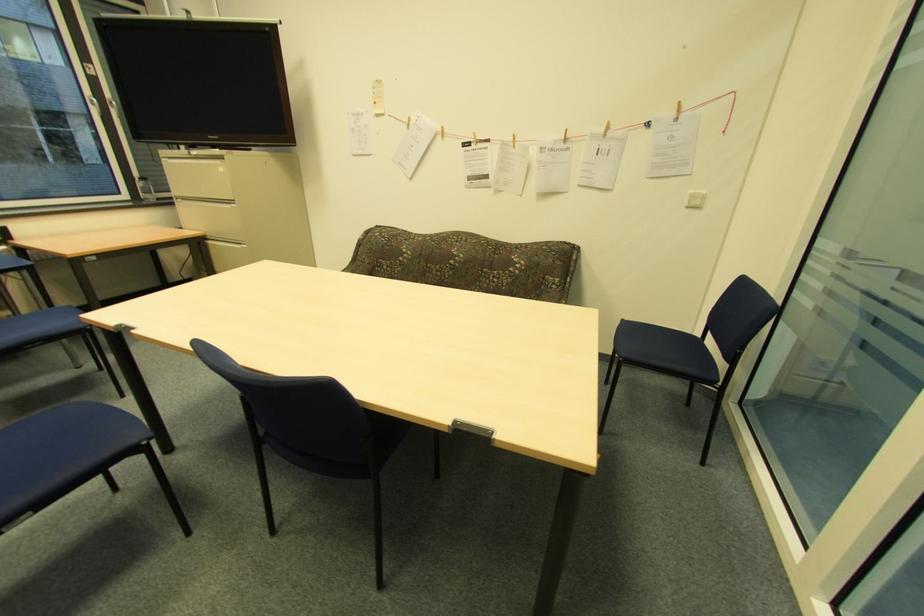
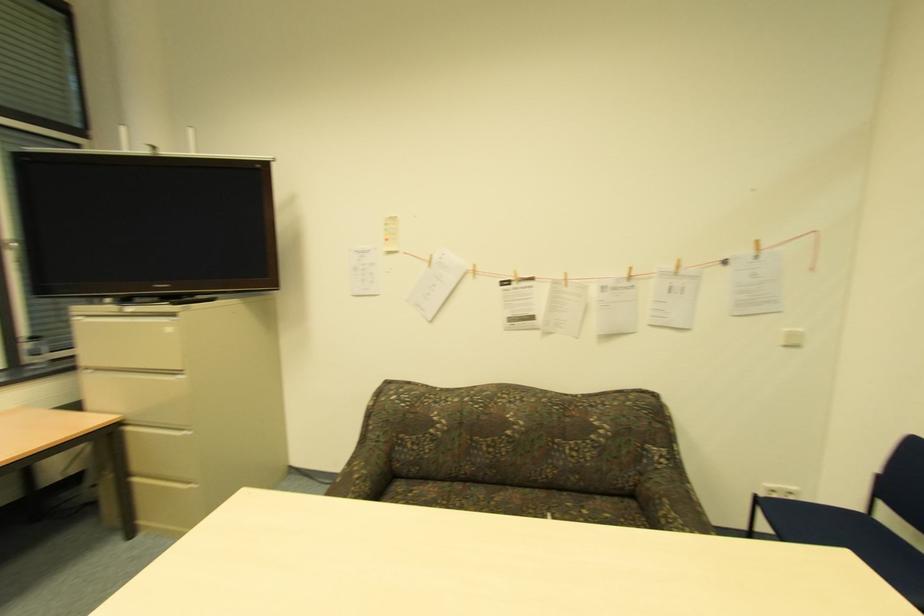
Where in the second image is the point corresponding to point (695, 197) from the first image?

(792, 334)